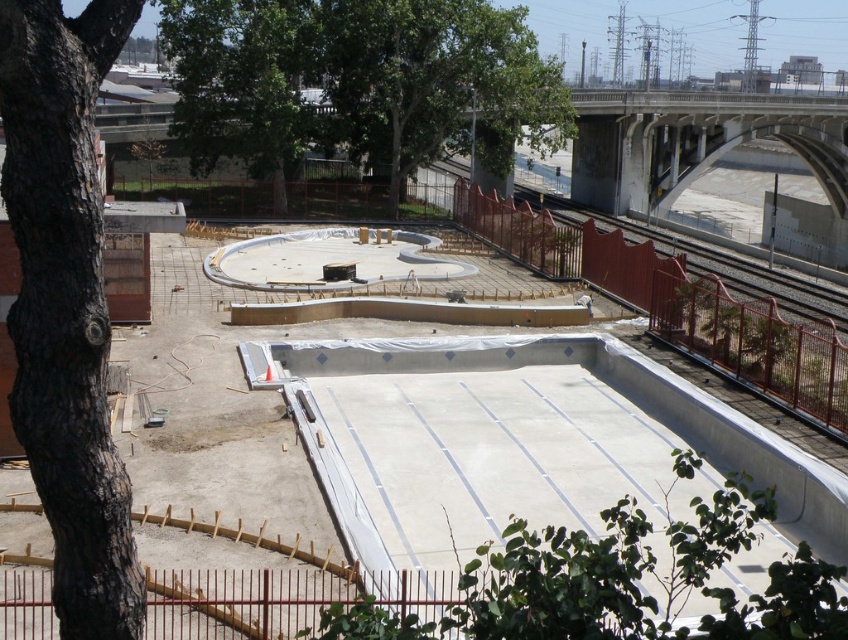
Question: Which object appears farthest from the camera in this image?

Choices:
 (A) black rough bark tree at left
 (B) green leafy tree at upper center

Answer: (B)

Question: From the image, what is the correct spatial relationship of black rough bark tree at left in relation to green leafy tree at upper center?

Choices:
 (A) right
 (B) left

Answer: (B)

Question: Can you confirm if black rough bark tree at left is positioned below green leafy tree at upper center?

Choices:
 (A) yes
 (B) no

Answer: (A)

Question: Among these points, which one is nearest to the camera?

Choices:
 (A) (289, 100)
 (B) (104, 1)

Answer: (B)

Question: Does black rough bark tree at left come behind green leafy tree at upper center?

Choices:
 (A) yes
 (B) no

Answer: (B)